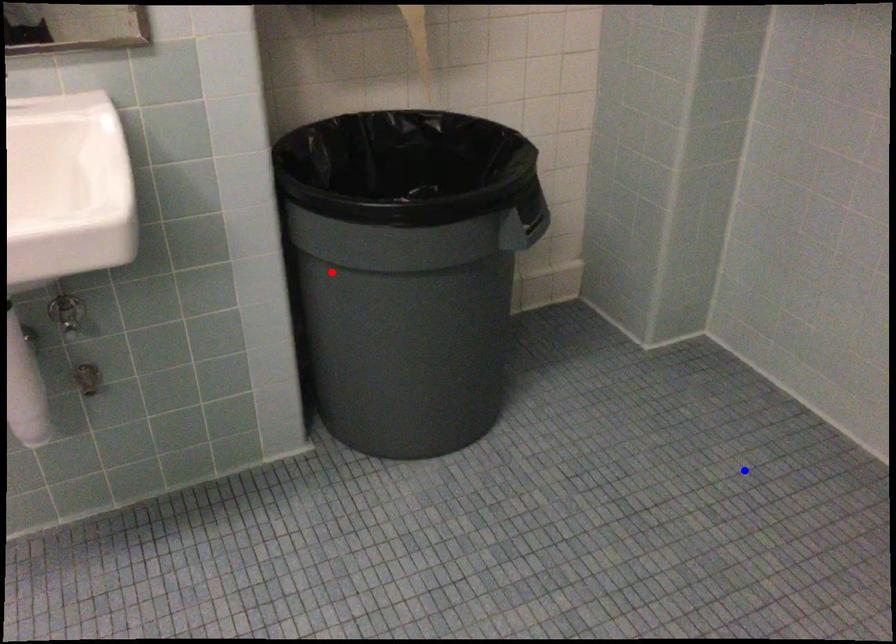
Question: Two points are marked on the image. Which point is closer to the camera?

Choices:
 (A) Blue point is closer.
 (B) Red point is closer.

Answer: (B)